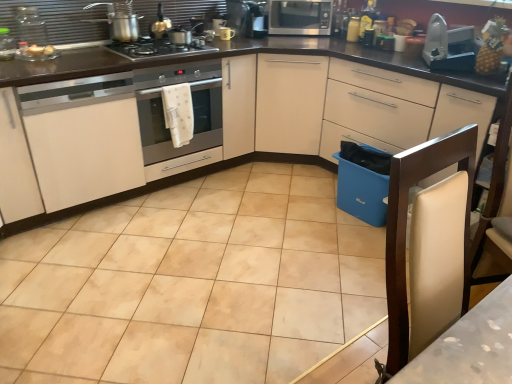
The width and height of the screenshot is (512, 384). What are the coordinates of `vacant region to the left of blue plastic bin at lower right` in the screenshot? It's located at (312, 211).